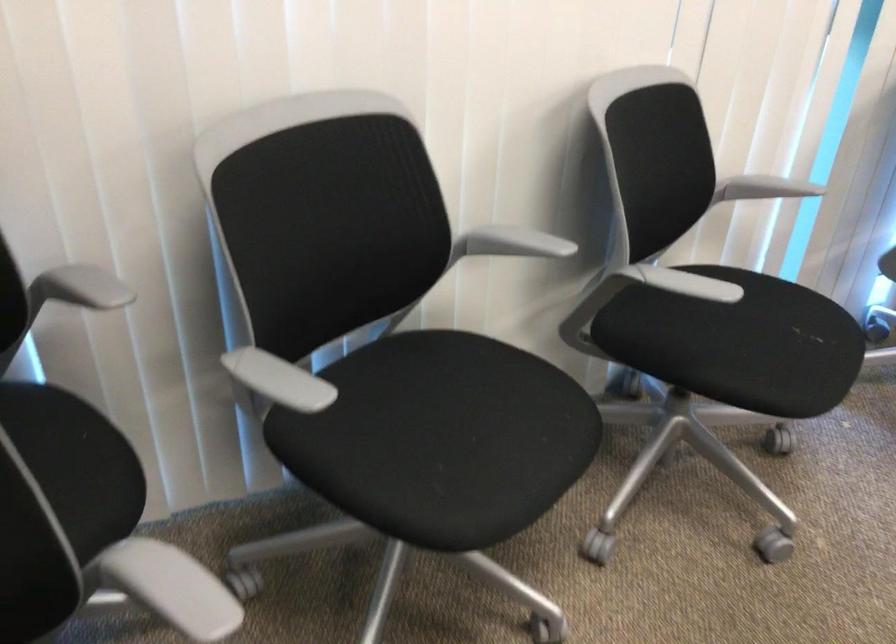
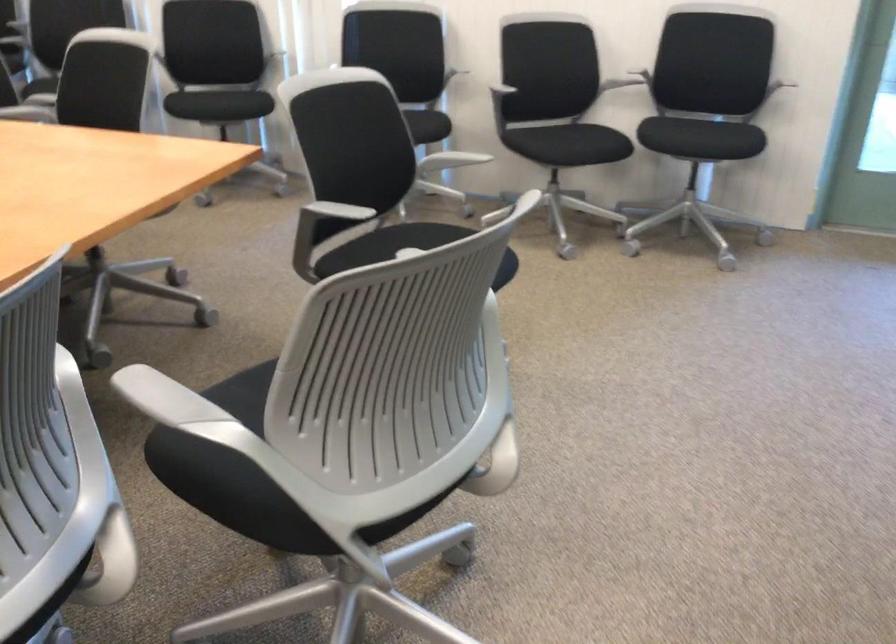
Find the pixel in the second image that matches pixel 771 330 in the first image.

(238, 102)